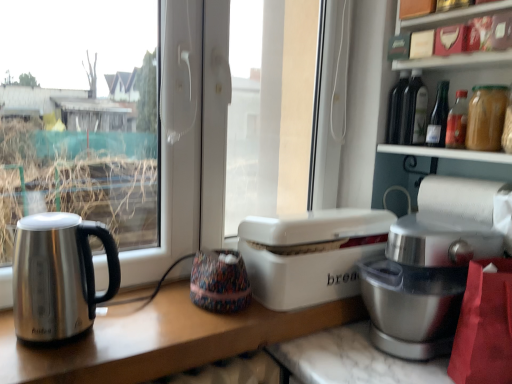
Question: Does satin silver mixer at right touch white plastic bread bin at center?

Choices:
 (A) no
 (B) yes

Answer: (A)

Question: Is satin silver mixer at right turned away from white plastic bread bin at center?

Choices:
 (A) yes
 (B) no

Answer: (B)

Question: Does satin silver mixer at right come behind white plastic bread bin at center?

Choices:
 (A) no
 (B) yes

Answer: (A)

Question: Is satin silver mixer at right located outside white plastic bread bin at center?

Choices:
 (A) yes
 (B) no

Answer: (A)

Question: Is satin silver mixer at right taller than white plastic bread bin at center?

Choices:
 (A) yes
 (B) no

Answer: (A)

Question: From the image's perspective, is white plastic bread bin at center positioned above or below white paper at right?

Choices:
 (A) below
 (B) above

Answer: (A)

Question: Relative to white paper at right, is white plastic bread bin at center in front or behind?

Choices:
 (A) behind
 (B) front

Answer: (B)

Question: In the image, is white plastic bread bin at center on the left side or the right side of white paper at right?

Choices:
 (A) right
 (B) left

Answer: (B)

Question: Based on their sizes in the image, would you say white plastic bread bin at center is bigger or smaller than white paper at right?

Choices:
 (A) small
 (B) big

Answer: (B)

Question: In terms of width, does white paper at right look wider or thinner when compared to translucent glass bottle at upper right, placed as the first bottle when sorted from front to back?

Choices:
 (A) wide
 (B) thin

Answer: (B)

Question: From the image's perspective, relative to translucent glass bottle at upper right, which is the second bottle in back-to-front order, is white paper at right above or below?

Choices:
 (A) above
 (B) below

Answer: (B)

Question: From their relative heights in the image, would you say white paper at right is taller or shorter than translucent glass bottle at upper right, placed as the first bottle when sorted from front to back?

Choices:
 (A) tall
 (B) short

Answer: (B)

Question: Relative to translucent glass bottle at upper right, which is the second bottle in back-to-front order, is white paper at right in front or behind?

Choices:
 (A) behind
 (B) front

Answer: (A)

Question: From a real-world perspective, is satin silver mixer at right physically located above or below white paper at right?

Choices:
 (A) above
 (B) below

Answer: (B)

Question: Would you say satin silver mixer at right is inside or outside white paper at right?

Choices:
 (A) inside
 (B) outside

Answer: (B)